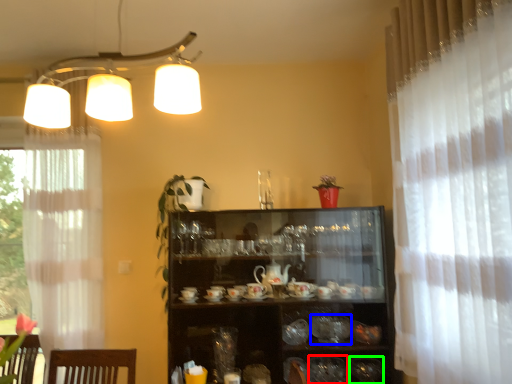
Question: Which object is positioned closest to tableware (highlighted by a red box)? Select from tableware (highlighted by a blue box) and tableware (highlighted by a green box).

Choices:
 (A) tableware
 (B) tableware

Answer: (B)